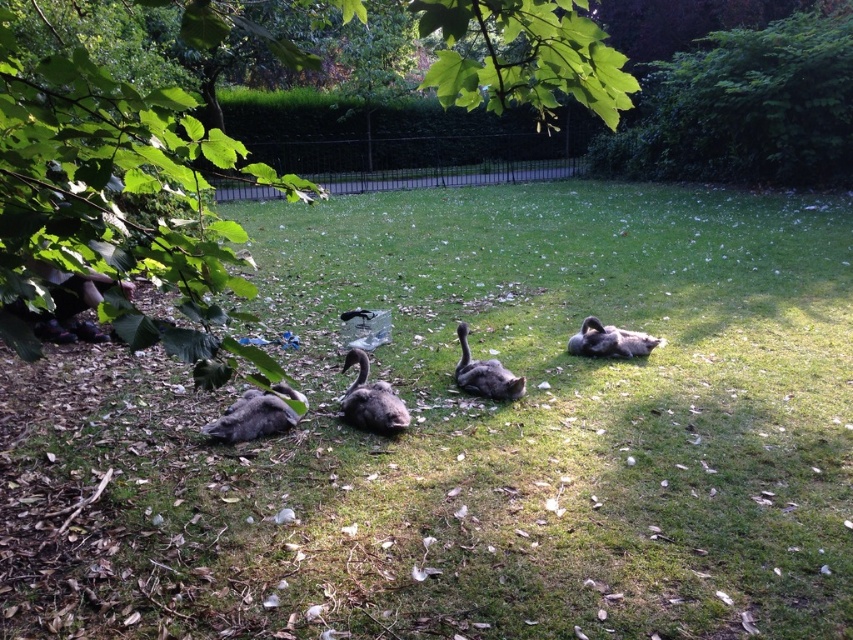
You are standing at the center of the grassy area and see a point marked at coordinates (370, 401). What object is located at that point?

The point at coordinates (370, 401) indicates a dark gray downy goose at center.

You are a nature photographer observing the scene. You notice a dark gray downy goose at center and a gray downy duckling at center. Which one is positioned to the left?

The dark gray downy goose at center is to the left of the gray downy duckling at center.